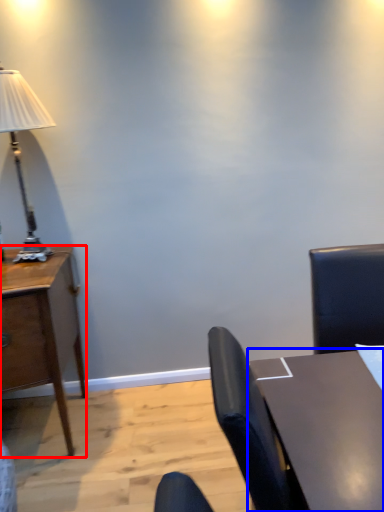
Question: Which object appears farthest to the camera in this image, desk (highlighted by a red box) or table (highlighted by a blue box)?

Choices:
 (A) desk
 (B) table

Answer: (A)